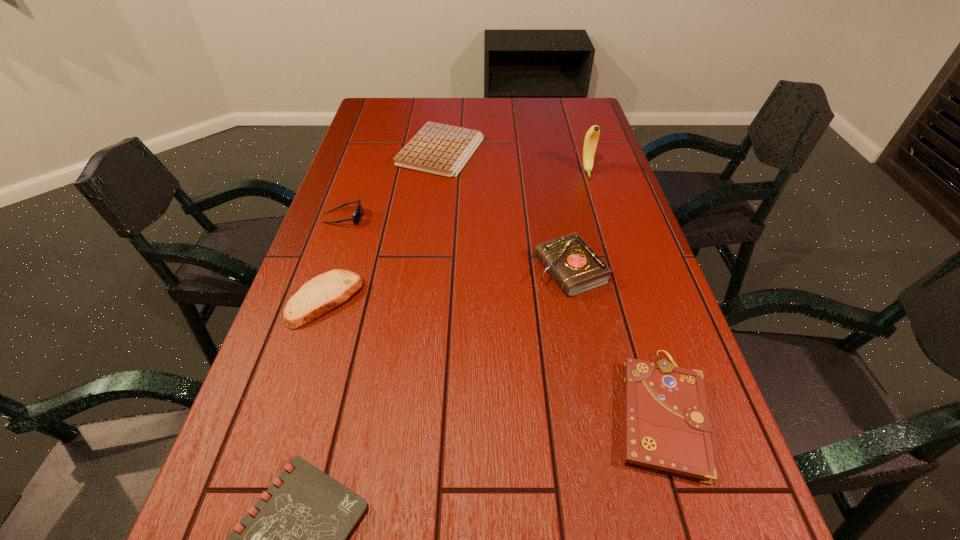
Identify the location of banana. (591, 139).

The image size is (960, 540). What are the coordinates of `diary` in the screenshot? It's located at (576, 268).

Where is `sunglasses`? sunglasses is located at coordinates (358, 212).

At what (x,y) coordinates should I click in order to perform the action: click on the fifth nearest object. Please return your answer as a coordinate pair (x, y). The height and width of the screenshot is (540, 960). Looking at the image, I should click on (358, 212).

The image size is (960, 540). I want to click on pita bread, so click(x=321, y=294).

The image size is (960, 540). In order to click on the tallest notebook in this screenshot , I will do `click(667, 429)`.

Where is `the farthest notebook`? the farthest notebook is located at coordinates (440, 149).

Identify the location of the second tallest notebook. The height and width of the screenshot is (540, 960). (440, 149).

Find the location of a particular element. The height and width of the screenshot is (540, 960). vacant space located 0.050m from the stem of the banana is located at coordinates (592, 189).

Where is `free point located on the front of the sixth shortest object`? The width and height of the screenshot is (960, 540). free point located on the front of the sixth shortest object is located at coordinates (592, 382).